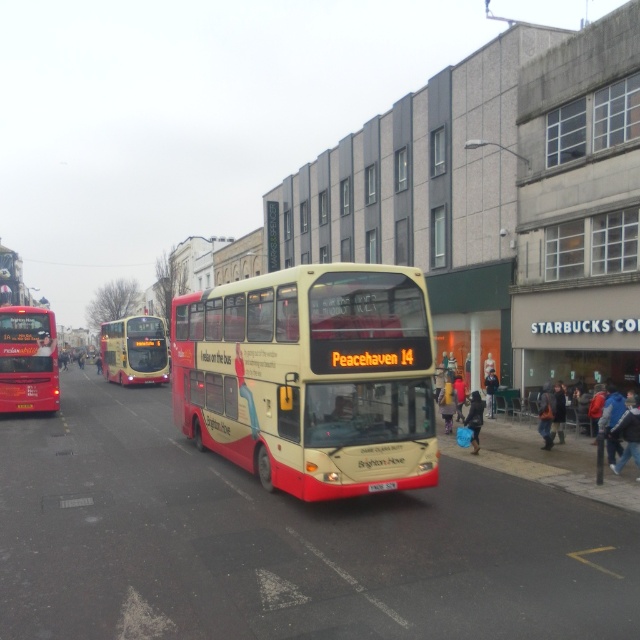
Question: Can you confirm if yellow matte bus at center is wider than yellow plastic bus at center?

Choices:
 (A) yes
 (B) no

Answer: (A)

Question: Which is nearer to the beige matte double-decker bus at center?

Choices:
 (A) yellow matte bus at center
 (B) white plastic license plate at center
 (C) yellow plastic bus at center

Answer: (B)

Question: Can you confirm if matte red bus at left is wider than yellow matte bus at center?

Choices:
 (A) yes
 (B) no

Answer: (B)

Question: Which point is closer to the camera taking this photo?

Choices:
 (A) (376, 484)
 (B) (49, 323)

Answer: (A)

Question: Is yellow matte bus at center below white plastic license plate at center?

Choices:
 (A) yes
 (B) no

Answer: (B)

Question: Which of these objects is positioned farthest from the matte red bus at left?

Choices:
 (A) yellow matte bus at center
 (B) yellow plastic bus at center

Answer: (A)